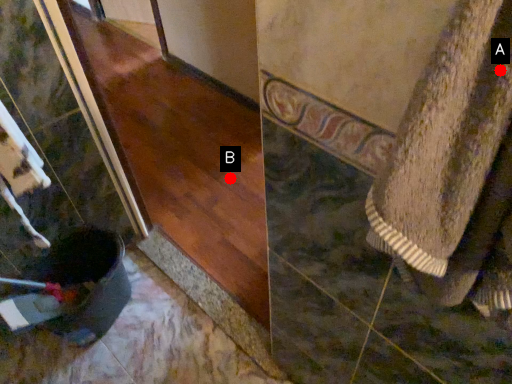
Question: Two points are circled on the image, labeled by A and B beside each circle. Which point appears closest to the camera in this image?

Choices:
 (A) A is closer
 (B) B is closer

Answer: (A)